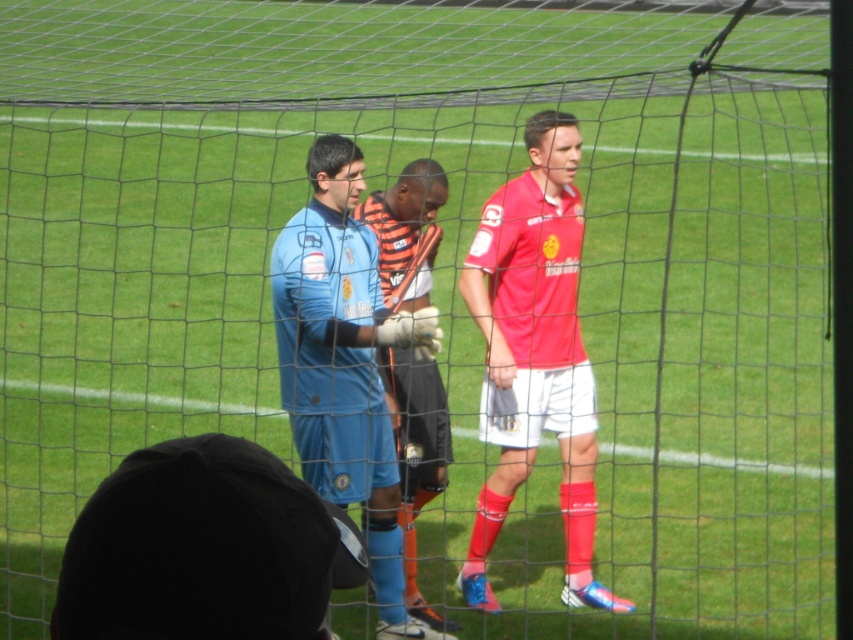
Question: Does blue jersey at center lie behind blue matte jersey at center?

Choices:
 (A) no
 (B) yes

Answer: (A)

Question: Can you confirm if blue jersey at center is smaller than blue matte jersey at center?

Choices:
 (A) no
 (B) yes

Answer: (B)

Question: Which object appears closest to the camera in this image?

Choices:
 (A) blue matte jersey at center
 (B) matte red jersey at center
 (C) blue jersey at center

Answer: (C)

Question: Which point is closer to the camera taking this photo?

Choices:
 (A) (489, 212)
 (B) (311, 243)

Answer: (B)

Question: Can you confirm if blue jersey at center is positioned below matte red jersey at center?

Choices:
 (A) yes
 (B) no

Answer: (A)

Question: Which point is farther from the camera taking this photo?

Choices:
 (A) (71, 580)
 (B) (332, 204)
 (C) (572, 545)

Answer: (C)